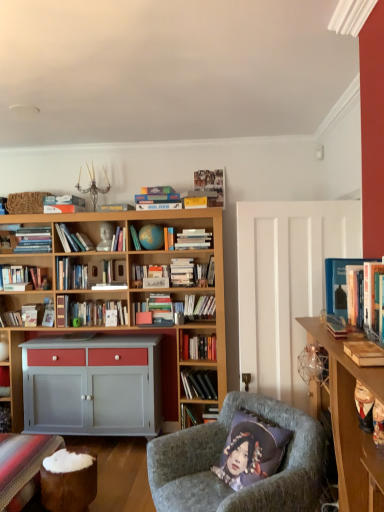
Locate an element on the screen. The image size is (384, 512). free space above hardcover book at center (from a real-world perspective) is located at coordinates (159, 259).